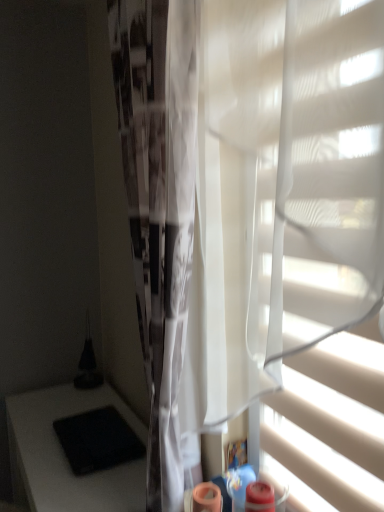
Question: Should I look upward or downward to see black matte table at lower left?

Choices:
 (A) up
 (B) down

Answer: (B)

Question: Can black matte pad at lower left be found inside white sheer fabric at center?

Choices:
 (A) yes
 (B) no

Answer: (B)

Question: Is white sheer fabric at center wider than black matte pad at lower left?

Choices:
 (A) no
 (B) yes

Answer: (A)

Question: Is white sheer fabric at center aimed at black matte pad at lower left?

Choices:
 (A) no
 (B) yes

Answer: (A)

Question: From a real-world perspective, is white sheer fabric at center physically above black matte pad at lower left?

Choices:
 (A) yes
 (B) no

Answer: (A)

Question: Does white sheer fabric at center touch black matte pad at lower left?

Choices:
 (A) yes
 (B) no

Answer: (B)

Question: Is white sheer fabric at center thinner than black matte pad at lower left?

Choices:
 (A) yes
 (B) no

Answer: (A)

Question: Is white sheer fabric at center not close to white matte blind at right?

Choices:
 (A) yes
 (B) no

Answer: (B)

Question: From a real-world perspective, is white sheer fabric at center physically below white matte blind at right?

Choices:
 (A) no
 (B) yes

Answer: (A)

Question: From a real-world perspective, is white sheer fabric at center positioned over white matte blind at right based on gravity?

Choices:
 (A) no
 (B) yes

Answer: (B)

Question: Can you confirm if white sheer fabric at center is wider than white matte blind at right?

Choices:
 (A) no
 (B) yes

Answer: (B)

Question: Considering the relative sizes of white sheer fabric at center and white matte blind at right in the image provided, is white sheer fabric at center taller than white matte blind at right?

Choices:
 (A) yes
 (B) no

Answer: (A)

Question: Can you confirm if white sheer fabric at center is smaller than white matte blind at right?

Choices:
 (A) yes
 (B) no

Answer: (B)

Question: Can you confirm if black matte pad at lower left is wider than white sheer fabric at center?

Choices:
 (A) no
 (B) yes

Answer: (B)